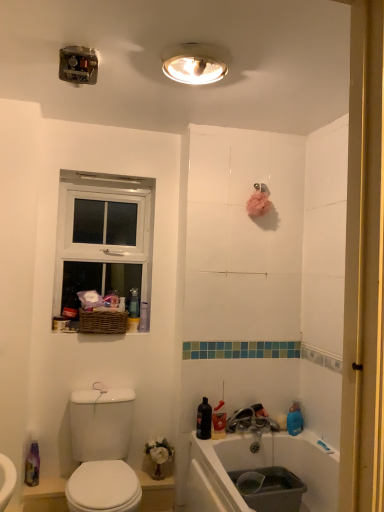
What is the approximate width of white plastic light fixture at upper center?

It is 11.37 inches.

Describe the element at coordinates (102, 321) in the screenshot. I see `woven brown basket at upper left` at that location.

Locate an element on the screen. This screenshot has height=512, width=384. translucent plastic spray bottle at lower left is located at coordinates (32, 465).

From a real-world perspective, is matte plastic container at left positioned under translucent plastic spray bottle at lower left based on gravity?

No.

Which is in front, point (67, 326) or point (36, 485)?

Positioned in front is point (36, 485).

Is matte plastic container at left beside translucent plastic spray bottle at lower left?

They are not placed beside each other.

Considering the positions of objects matte plastic container at left and translucent plastic spray bottle at lower left in the image provided, who is more to the right, matte plastic container at left or translucent plastic spray bottle at lower left?

Positioned to the right is matte plastic container at left.

From a real-world perspective, is white plastic light fixture at upper center on top of white glossy toilet at lower left?

Correct, in the physical world, white plastic light fixture at upper center is higher than white glossy toilet at lower left.

Is white plastic light fixture at upper center thinner than white glossy toilet at lower left?

Yes.

Is white glossy toilet at lower left thinner than white wooden window at upper left?

No.

Does white glossy toilet at lower left turn towards white wooden window at upper left?

No.

Which object is closer to the camera taking this photo, white glossy toilet at lower left or white wooden window at upper left?

white glossy toilet at lower left.

From the image's perspective, is white glossy toilet at lower left located beneath white wooden window at upper left?

Yes.

Is white glossy toilet at lower left behind matte plastic container at left?

No, white glossy toilet at lower left is closer to the camera.

At what (x,y) coordinates should I click in order to perform the action: click on toilet below the matte plastic container at left (from a real-world perspective). Please return your answer as a coordinate pair (x, y). This screenshot has width=384, height=512. Looking at the image, I should click on (102, 451).

Is point (98, 450) closer or farther from the camera than point (55, 327)?

Point (98, 450) appears to be closer to the viewer than point (55, 327).

Consider the image. Is white glossy toilet at lower left to the right of metallic silver faucet at lower center from the viewer's perspective?

In fact, white glossy toilet at lower left is to the left of metallic silver faucet at lower center.

Does point (96, 470) come farther from viewer compared to point (247, 413)?

That is False.

Is white glossy toilet at lower left not near metallic silver faucet at lower center?

No, white glossy toilet at lower left is not far away from metallic silver faucet at lower center.

Between white glossy toilet at lower left and metallic silver faucet at lower center, which one has more height?

Standing taller between the two is white glossy toilet at lower left.

Does white glossy toilet at lower left have a greater height compared to white plastic light fixture at upper center?

Correct, white glossy toilet at lower left is much taller as white plastic light fixture at upper center.

Locate an element on the screen. Image resolution: width=384 pixels, height=512 pixels. toilet to the left of white plastic light fixture at upper center is located at coordinates (102, 451).

Relative to white plastic light fixture at upper center, is white glossy toilet at lower left in front or behind?

white glossy toilet at lower left is behind white plastic light fixture at upper center.

Considering the positions of objects white glossy toilet at lower left and white plastic light fixture at upper center in the image provided, who is more to the left, white glossy toilet at lower left or white plastic light fixture at upper center?

white glossy toilet at lower left.

Based on the photo, is metallic silver faucet at lower center positioned in front of white glossy toilet at lower left?

No, metallic silver faucet at lower center is behind white glossy toilet at lower left.

Which is less distant, [246,423] or [117,408]?

Point [246,423] is positioned farther from the camera compared to point [117,408].

From a real-world perspective, is metallic silver faucet at lower center above or below white glossy toilet at lower left?

From a real-world perspective, metallic silver faucet at lower center is physically above white glossy toilet at lower left.

Can we say metallic silver faucet at lower center lies outside white glossy toilet at lower left?

metallic silver faucet at lower center is positioned outside white glossy toilet at lower left.

Locate an element on the screen. cleaning product that appears below the matte plastic container at left (from a real-world perspective) is located at coordinates (32, 465).

You are a GUI agent. You are given a task and a screenshot of the screen. Output one action in this format:
    pyautogui.click(x=<x>, y=<y>)
    Task: Click on the light fixture above the white glossy toilet at lower left (from a real-world perspective)
    The width and height of the screenshot is (384, 512).
    Given the screenshot: What is the action you would take?
    pyautogui.click(x=195, y=63)

Which object lies further to the anchor point matte plastic container at left, metallic silver faucet at lower center or white wooden window at upper left?

Based on the image, metallic silver faucet at lower center appears to be further to matte plastic container at left.

Estimate the real-world distances between objects in this image. Which object is closer to white wooden window at upper left, metallic silver faucet at lower center or matte plastic container at left?

Based on the image, matte plastic container at left appears to be nearer to white wooden window at upper left.

From the image, which object appears to be nearer to matte plastic container at left, white glossy toilet at lower left or translucent plastic spray bottle at lower left?

Based on the image, white glossy toilet at lower left appears to be nearer to matte plastic container at left.

Looking at the image, which one is located further to matte plastic container at left, metallic silver faucet at lower center or translucent plastic spray bottle at lower left?

The object further to matte plastic container at left is metallic silver faucet at lower center.

In the scene shown: When comparing their distances from white wooden window at upper left, does white plastic light fixture at upper center or metallic silver faucet at lower center seem closer?

white plastic light fixture at upper center is closer to white wooden window at upper left.

Estimate the real-world distances between objects in this image. Which object is further from woven brown basket at upper left, white plastic light fixture at upper center or matte plastic container at left?

white plastic light fixture at upper center is further to woven brown basket at upper left.

Considering their positions, is white glossy toilet at lower left positioned further to metallic silver faucet at lower center than translucent plastic spray bottle at lower left?

translucent plastic spray bottle at lower left is positioned further to the anchor metallic silver faucet at lower center.

Considering their positions, is translucent plastic spray bottle at lower left positioned further to woven brown basket at upper left than white glossy toilet at lower left?

translucent plastic spray bottle at lower left.

What are the coordinates of `basket between white wooden window at upper left and matte plastic container at left in the vertical direction` in the screenshot? It's located at point(102,321).

In order to click on toilet between woven brown basket at upper left and metallic silver faucet at lower center in the horizontal direction in this screenshot , I will do click(102, 451).

You are a GUI agent. You are given a task and a screenshot of the screen. Output one action in this format:
    pyautogui.click(x=<x>, y=<y>)
    Task: Click on the window between translucent plastic spray bottle at lower left and metallic silver faucet at lower center in the horizontal direction
    This screenshot has width=384, height=512.
    Given the screenshot: What is the action you would take?
    pyautogui.click(x=103, y=236)

Where is `toiletry between white wooden window at upper left and translucent plastic spray bottle at lower left in the vertical direction`? toiletry between white wooden window at upper left and translucent plastic spray bottle at lower left in the vertical direction is located at coordinates (60, 324).